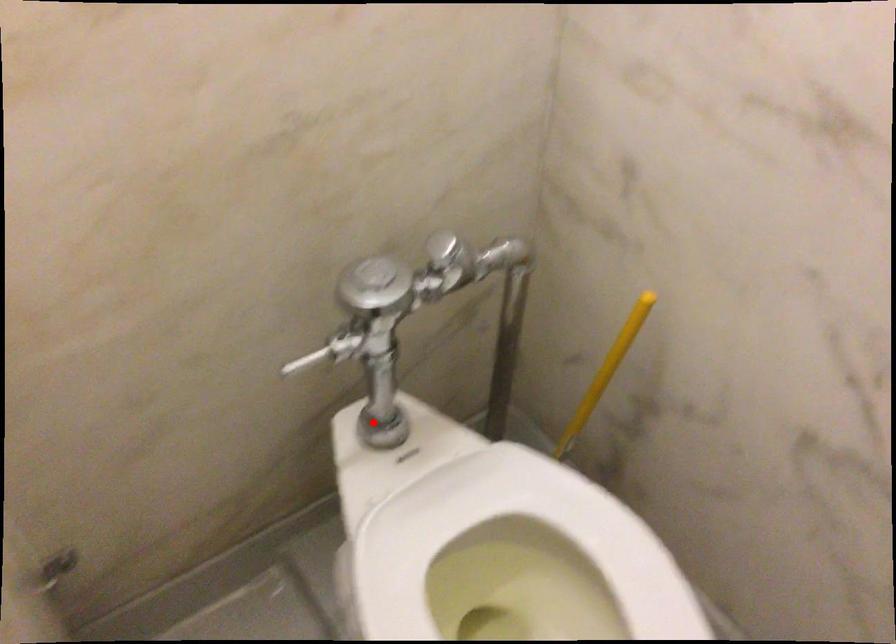
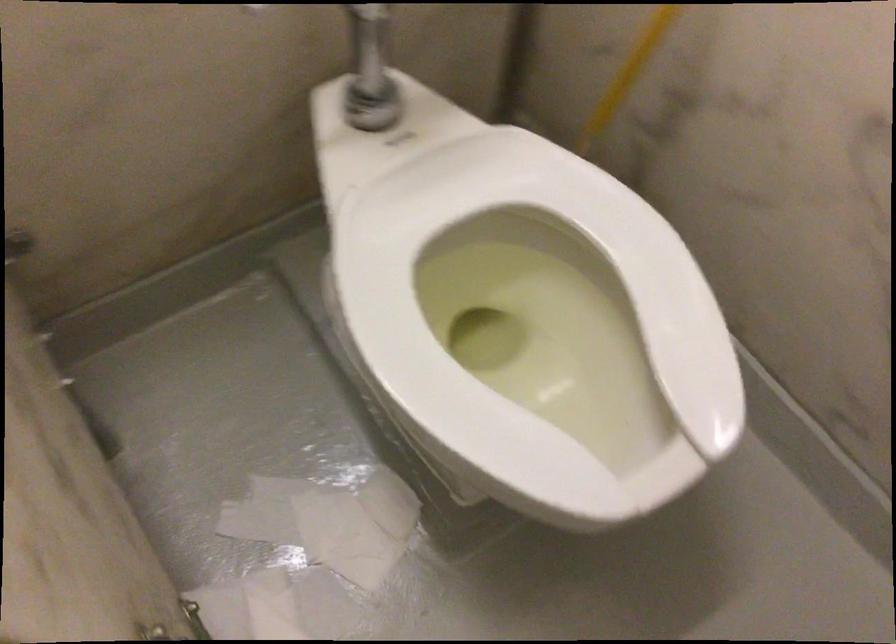
Question: A red point is marked in image1. In image2, is the corresponding 3D point closer to the camera or farther? Reply with the corresponding letter.

Choices:
 (A) The corresponding 3D point is closer.
 (B) The corresponding 3D point is farther.

Answer: (A)